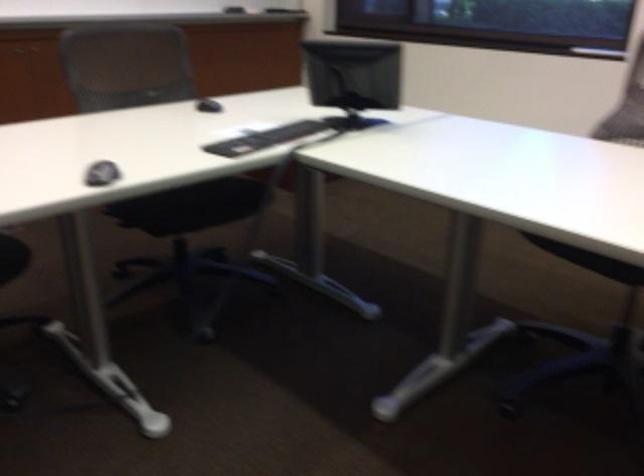
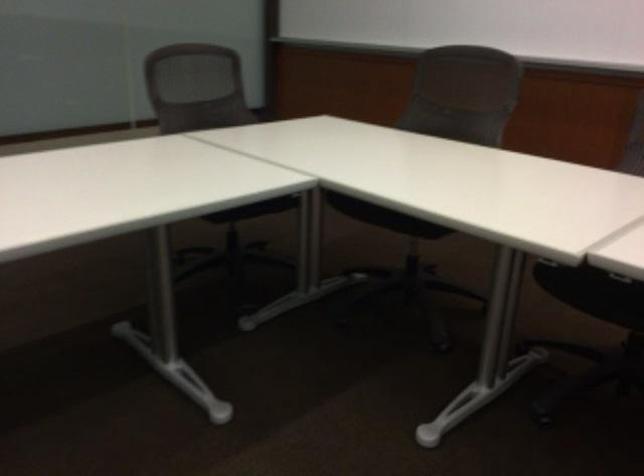
How did the camera likely rotate?

The camera rotated toward left-down.